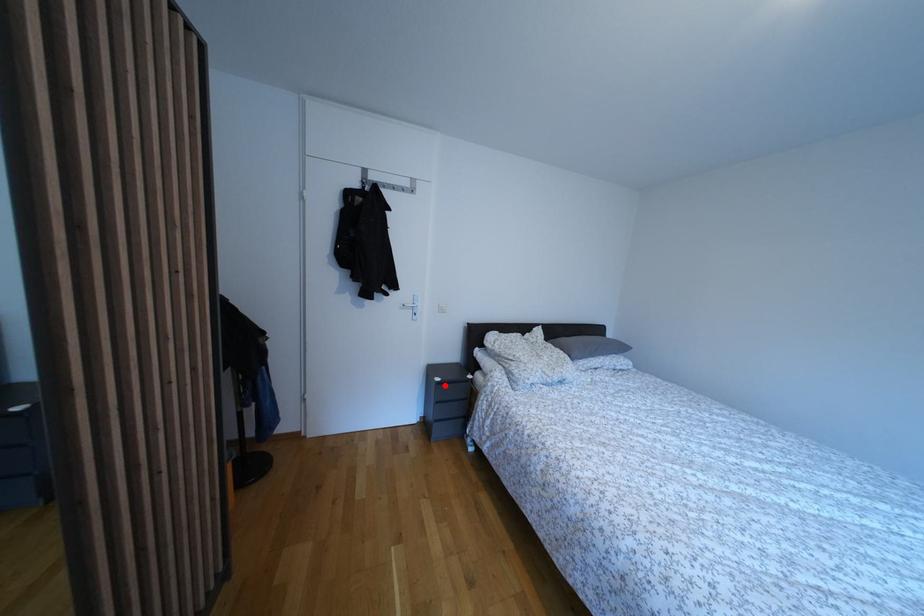
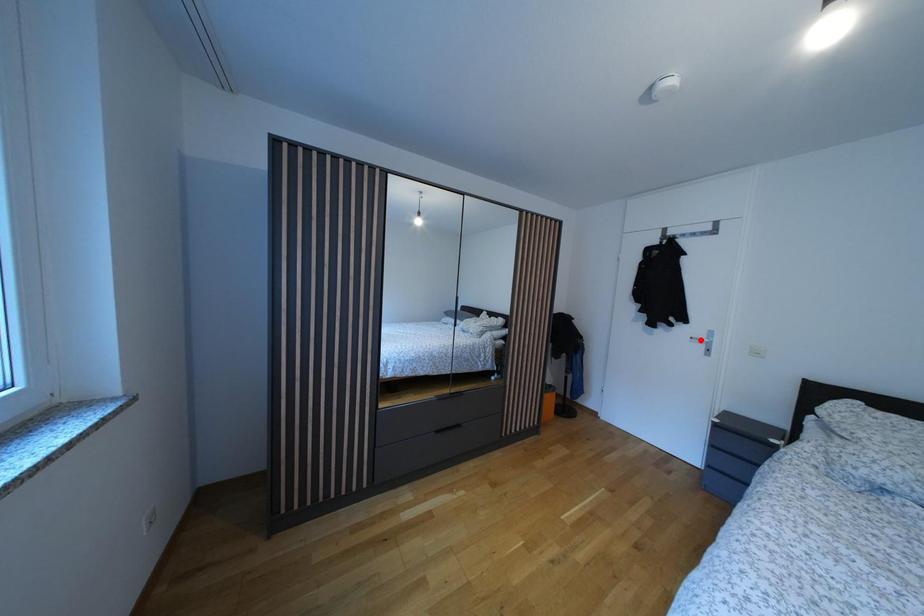
I am providing you with two images of the same scene from different viewpoints. A red point is marked on the first image and another point is marked on the second image. Is the red point in image1 aligned with the point shown in image2?

No